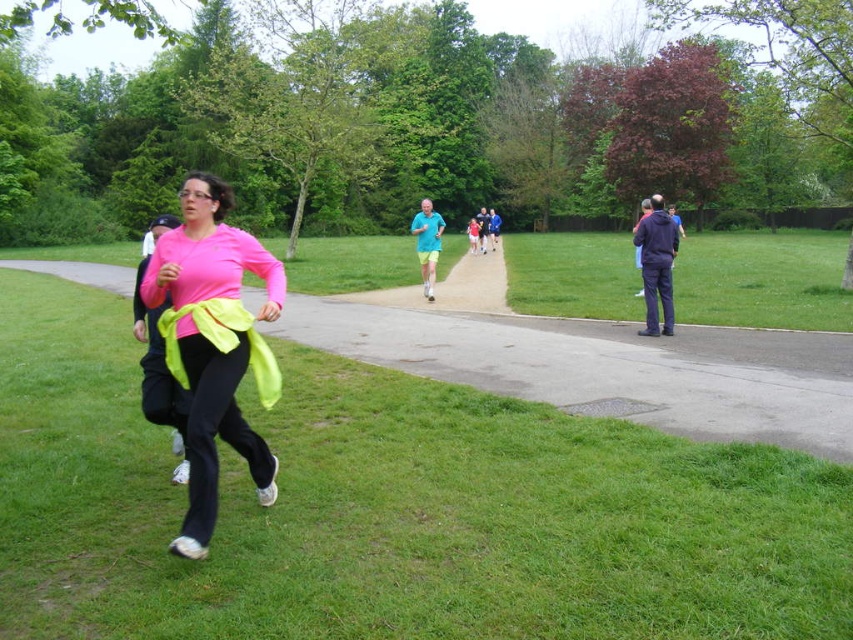
Question: Which object appears closest to the camera in this image?

Choices:
 (A) matte blue shirt at center
 (B) pink matte shirt at center

Answer: (B)

Question: Is green grass at lower left thinner than pink matte shirt at center?

Choices:
 (A) no
 (B) yes

Answer: (A)

Question: Which point is farther to the camera?

Choices:
 (A) matte blue shirt at center
 (B) blue fabric shirt at center

Answer: (B)

Question: Where is dark blue jacket at right located in relation to matte blue shirt at center in the image?

Choices:
 (A) left
 (B) right

Answer: (B)

Question: Which object appears closest to the camera in this image?

Choices:
 (A) dark blue jacket at right
 (B) blue fabric shirt at center
 (C) green grass at lower left

Answer: (C)

Question: Can you confirm if pink matte shirt at center is wider than blue fabric shirt at center?

Choices:
 (A) yes
 (B) no

Answer: (B)